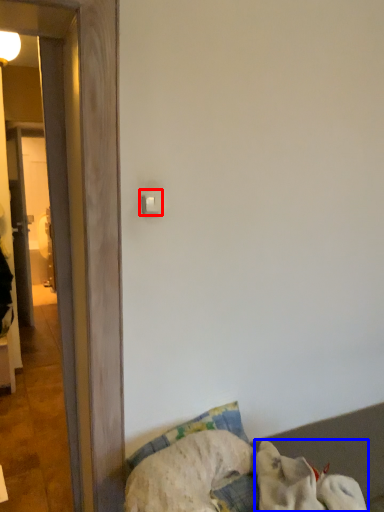
Question: Which point is further to the camera, light switch (highlighted by a red box) or dog (highlighted by a blue box)?

Choices:
 (A) light switch
 (B) dog

Answer: (A)